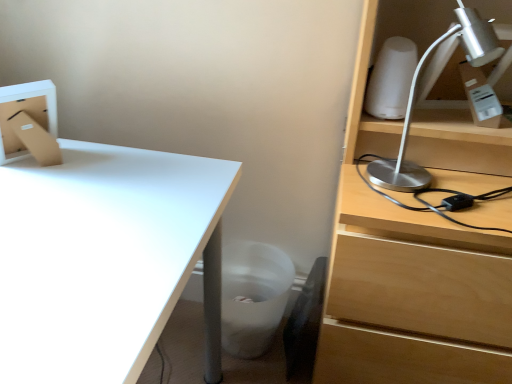
Question: Can you confirm if white glossy desk at lower left is positioned to the right of black leather swivel chair at lower center?

Choices:
 (A) no
 (B) yes

Answer: (A)

Question: Is white glossy desk at lower left oriented towards black leather swivel chair at lower center?

Choices:
 (A) no
 (B) yes

Answer: (A)

Question: From the image's perspective, would you say white glossy desk at lower left is shown under black leather swivel chair at lower center?

Choices:
 (A) yes
 (B) no

Answer: (B)

Question: From a real-world perspective, does white glossy desk at lower left sit lower than black leather swivel chair at lower center?

Choices:
 (A) yes
 (B) no

Answer: (B)

Question: Is white glossy desk at lower left shorter than black leather swivel chair at lower center?

Choices:
 (A) yes
 (B) no

Answer: (B)

Question: Is white glossy desk at lower left wider than black leather swivel chair at lower center?

Choices:
 (A) yes
 (B) no

Answer: (A)

Question: Is black leather swivel chair at lower center bigger than white matte trash bin/can at lower center?

Choices:
 (A) no
 (B) yes

Answer: (A)

Question: Is black leather swivel chair at lower center not within white matte trash bin/can at lower center?

Choices:
 (A) yes
 (B) no

Answer: (B)

Question: From the image's perspective, is black leather swivel chair at lower center on white matte trash bin/can at lower center?

Choices:
 (A) no
 (B) yes

Answer: (A)

Question: Can you confirm if black leather swivel chair at lower center is taller than white matte trash bin/can at lower center?

Choices:
 (A) yes
 (B) no

Answer: (A)

Question: Considering the relative sizes of black leather swivel chair at lower center and white matte trash bin/can at lower center in the image provided, is black leather swivel chair at lower center wider than white matte trash bin/can at lower center?

Choices:
 (A) no
 (B) yes

Answer: (A)

Question: Considering the relative positions of black leather swivel chair at lower center and white matte trash bin/can at lower center in the image provided, is black leather swivel chair at lower center to the right of white matte trash bin/can at lower center from the viewer's perspective?

Choices:
 (A) no
 (B) yes

Answer: (B)

Question: Could you tell me if white matte trash bin/can at lower center is facing black leather swivel chair at lower center?

Choices:
 (A) no
 (B) yes

Answer: (B)